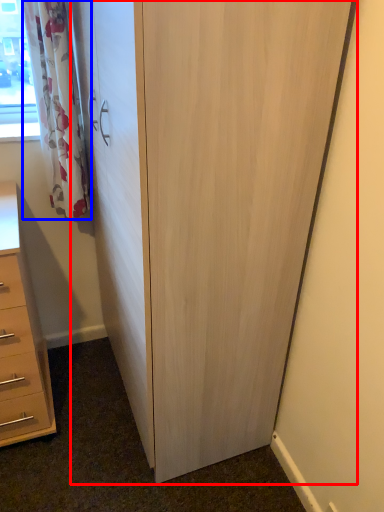
Question: Which point is closer to the camera, cupboard (highlighted by a red box) or curtain (highlighted by a blue box)?

Choices:
 (A) cupboard
 (B) curtain

Answer: (A)